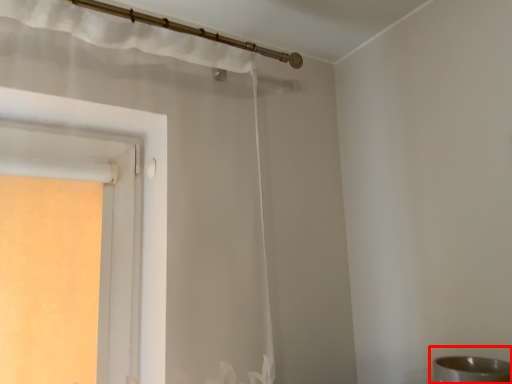
Question: From the image's perspective, where is sink (annotated by the red box) located in relation to curtain in the image?

Choices:
 (A) above
 (B) below

Answer: (B)